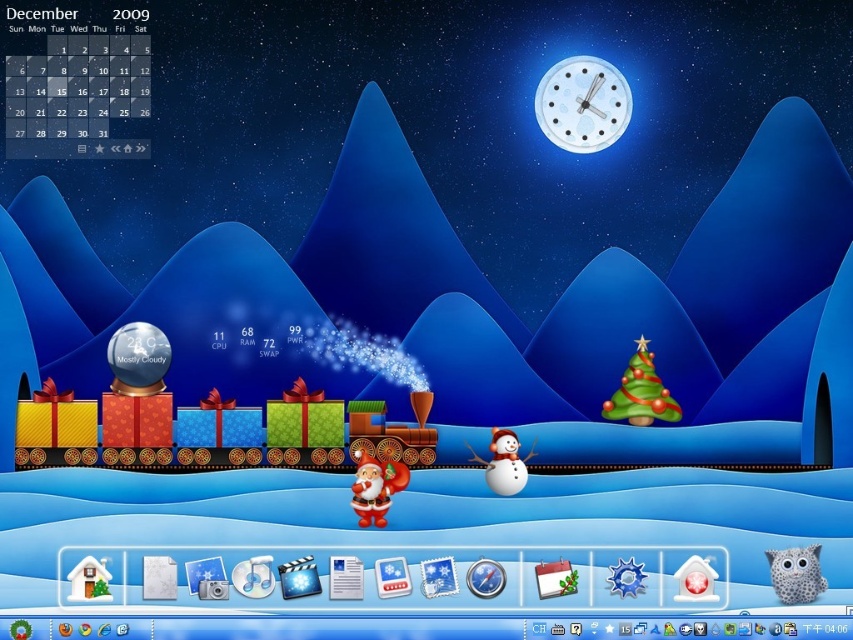
Question: In this image, where is white plastic clock at upper center located relative to white matte snowman at center?

Choices:
 (A) left
 (B) right

Answer: (B)

Question: Which point is farther to the camera?

Choices:
 (A) white paper calendar at bottom center
 (B) red velvet santa at center
 (C) white matte snowman at center

Answer: (A)

Question: Which object is the closest to the white paper calendar at bottom center?

Choices:
 (A) white matte snowman at center
 (B) white plastic clock at upper center
 (C) red velvet santa at center

Answer: (C)

Question: Among these points, which one is nearest to the camera?

Choices:
 (A) (329, 561)
 (B) (360, 492)

Answer: (B)

Question: Considering the relative positions of white plastic clock at upper center and white paper calendar at bottom center in the image provided, where is white plastic clock at upper center located with respect to white paper calendar at bottom center?

Choices:
 (A) below
 (B) above

Answer: (B)

Question: Is red velvet santa at center in front of white matte snowman at center?

Choices:
 (A) yes
 (B) no

Answer: (A)